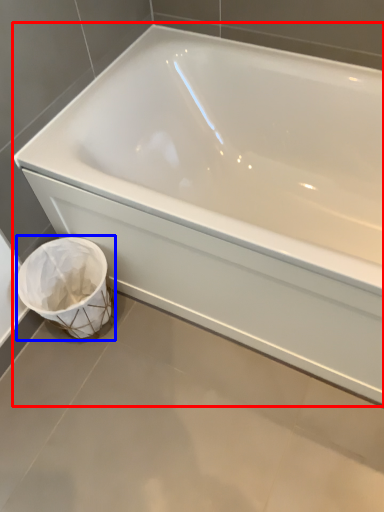
Question: Which object is further to the camera taking this photo, bathtub (highlighted by a red box) or toilet bowl (highlighted by a blue box)?

Choices:
 (A) bathtub
 (B) toilet bowl

Answer: (B)